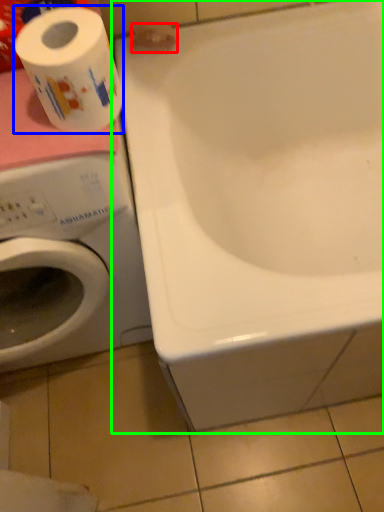
Question: Based on their relative distances, which object is nearer to toilet paper (highlighted by a red box)? Choose from toilet paper (highlighted by a blue box) and bathtub (highlighted by a green box).

Choices:
 (A) toilet paper
 (B) bathtub

Answer: (B)